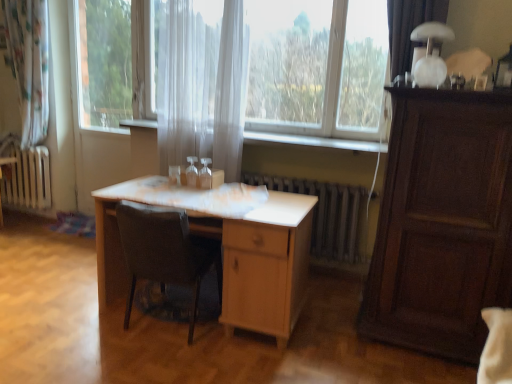
Question: Is point (96, 132) closer or farther from the camera than point (179, 274)?

Choices:
 (A) farther
 (B) closer

Answer: (A)

Question: From a real-world perspective, is transparent glass screen door at center positioned above or below dark brown leather chair at center?

Choices:
 (A) above
 (B) below

Answer: (A)

Question: Which object is positioned farthest from the white sheer curtain at center?

Choices:
 (A) translucent fabric curtain at center
 (B) white metallic radiator at center
 (C) transparent fabric at center
 (D) light wood table at center
 (E) dark brown leather chair at center

Answer: (C)

Question: Which object is the closest to the light wood table at center?

Choices:
 (A) white metallic radiator at center
 (B) dark wood cabinet at right
 (C) white glossy table lamp at upper right
 (D) transparent glass screen door at center
 (E) transparent fabric at center

Answer: (A)